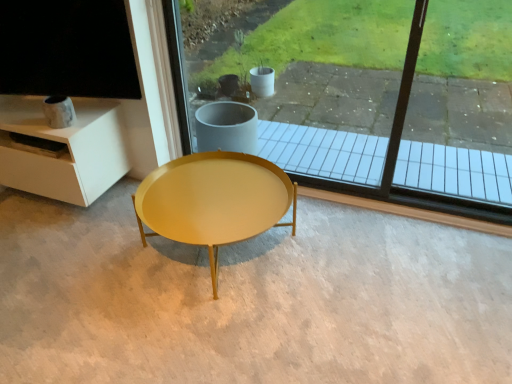
Question: Visually, is matte yellow table at center positioned to the left or to the right of transparent glass window at center?

Choices:
 (A) left
 (B) right

Answer: (A)

Question: In terms of width, does matte yellow table at center look wider or thinner when compared to transparent glass window at center?

Choices:
 (A) thin
 (B) wide

Answer: (B)

Question: Is matte yellow table at center spatially inside transparent glass window at center, or outside of it?

Choices:
 (A) inside
 (B) outside

Answer: (B)

Question: From the image's perspective, is transparent glass window at center positioned above or below matte yellow table at center?

Choices:
 (A) below
 (B) above

Answer: (B)

Question: Considering the positions of transparent glass window at center and matte yellow table at center in the image, is transparent glass window at center bigger or smaller than matte yellow table at center?

Choices:
 (A) small
 (B) big

Answer: (A)

Question: From a real-world perspective, relative to matte yellow table at center, is transparent glass window at center vertically above or below?

Choices:
 (A) below
 (B) above

Answer: (B)

Question: Is transparent glass window at center taller or shorter than matte yellow table at center?

Choices:
 (A) short
 (B) tall

Answer: (B)